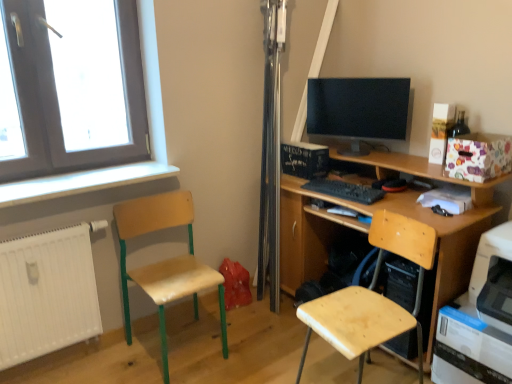
Question: Is wooden seat at left, the 1th chair positioned from the left, positioned beyond the bounds of white plastic printer at lower right?

Choices:
 (A) no
 (B) yes

Answer: (B)

Question: Is wooden seat at left, the 1th chair positioned from the left, positioned with its back to white plastic printer at lower right?

Choices:
 (A) yes
 (B) no

Answer: (B)

Question: Is white plastic printer at lower right a part of wooden seat at left, which is the second chair from right to left?

Choices:
 (A) no
 (B) yes

Answer: (A)

Question: Is wooden seat at left, which is the second chair from right to left, taller than white plastic printer at lower right?

Choices:
 (A) yes
 (B) no

Answer: (A)

Question: Does wooden seat at left, which is the second chair from right to left, have a greater width compared to white plastic printer at lower right?

Choices:
 (A) no
 (B) yes

Answer: (A)

Question: Is floral paper box at upper right inside or outside of white matte radiator at lower left?

Choices:
 (A) outside
 (B) inside

Answer: (A)

Question: From a real-world perspective, is floral paper box at upper right positioned above or below white matte radiator at lower left?

Choices:
 (A) above
 (B) below

Answer: (A)

Question: Is point (458, 163) positioned closer to the camera than point (1, 281)?

Choices:
 (A) closer
 (B) farther

Answer: (B)

Question: Visually, is floral paper box at upper right positioned to the left or to the right of white matte radiator at lower left?

Choices:
 (A) left
 (B) right

Answer: (B)

Question: Is white painted wood at left bigger or smaller than wooden seat at left, the 1th chair positioned from the left?

Choices:
 (A) big
 (B) small

Answer: (B)

Question: Is white painted wood at left inside or outside of wooden seat at left, the 1th chair positioned from the left?

Choices:
 (A) inside
 (B) outside

Answer: (B)

Question: Considering the positions of white painted wood at left and wooden seat at left, which is the second chair from right to left, in the image, is white painted wood at left wider or thinner than wooden seat at left, which is the second chair from right to left,?

Choices:
 (A) wide
 (B) thin

Answer: (B)

Question: From the image's perspective, is white painted wood at left above or below wooden seat at left, the 1th chair positioned from the left?

Choices:
 (A) below
 (B) above

Answer: (B)

Question: In the image, is floral paper box at upper right positioned in front of or behind wooden seat at left, the 1th chair positioned from the left?

Choices:
 (A) front
 (B) behind

Answer: (B)

Question: From a real-world perspective, relative to wooden seat at left, the 1th chair positioned from the left, is floral paper box at upper right vertically above or below?

Choices:
 (A) above
 (B) below

Answer: (A)